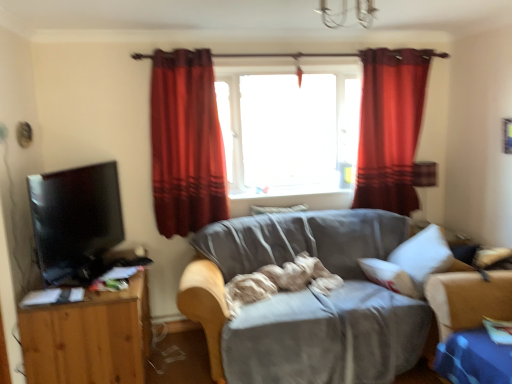
Question: Which direction should I rotate to look at red velvet curtain at upper center, placed as the 1th curtain when sorted from right to left?

Choices:
 (A) right
 (B) left

Answer: (A)

Question: Does transparent glass window at center appear on the right side of wooden tv stand at left?

Choices:
 (A) yes
 (B) no

Answer: (A)

Question: Is transparent glass window at center looking in the opposite direction of wooden tv stand at left?

Choices:
 (A) yes
 (B) no

Answer: (B)

Question: Is transparent glass window at center oriented towards wooden tv stand at left?

Choices:
 (A) no
 (B) yes

Answer: (A)

Question: Is transparent glass window at center further to camera compared to wooden tv stand at left?

Choices:
 (A) no
 (B) yes

Answer: (B)

Question: Can you confirm if transparent glass window at center is shorter than wooden tv stand at left?

Choices:
 (A) no
 (B) yes

Answer: (A)

Question: Can you confirm if transparent glass window at center is positioned to the left of wooden tv stand at left?

Choices:
 (A) no
 (B) yes

Answer: (A)

Question: Is matte black tv at left a part of wooden tv stand at left?

Choices:
 (A) yes
 (B) no

Answer: (B)

Question: Can we say wooden tv stand at left lies outside matte black tv at left?

Choices:
 (A) yes
 (B) no

Answer: (A)

Question: Considering the relative sizes of wooden tv stand at left and matte black tv at left in the image provided, is wooden tv stand at left thinner than matte black tv at left?

Choices:
 (A) no
 (B) yes

Answer: (A)

Question: Considering the relative sizes of wooden tv stand at left and matte black tv at left in the image provided, is wooden tv stand at left smaller than matte black tv at left?

Choices:
 (A) yes
 (B) no

Answer: (B)

Question: Does wooden tv stand at left appear on the left side of matte black tv at left?

Choices:
 (A) yes
 (B) no

Answer: (B)

Question: Is wooden tv stand at left further to the viewer compared to matte black tv at left?

Choices:
 (A) yes
 (B) no

Answer: (A)

Question: Is red velvet curtain at upper center, placed as the 1th curtain when sorted from right to left, to the left of velvet red curtain at center, which appears as the 2th curtain when viewed from the right, from the viewer's perspective?

Choices:
 (A) yes
 (B) no

Answer: (B)